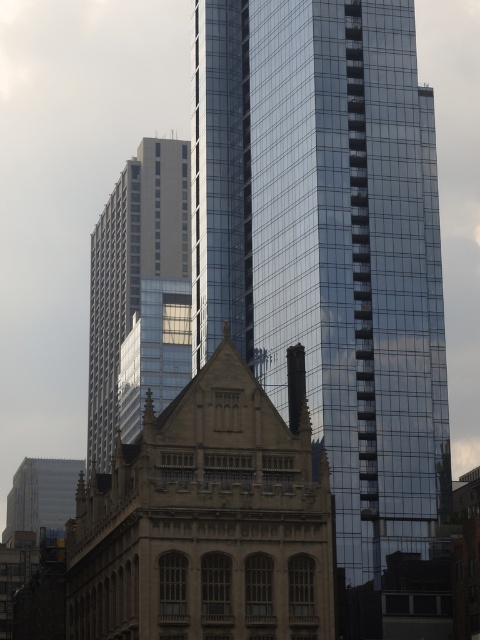
You are an architect planning to install a new lighting system. The brown stone bell tower at center and the silver metallic building at center are both candidates. Which structure requires more lights if the lighting intensity is proportional to the width of the building?

The silver metallic building at center requires more lights because it has a greater width than the brown stone bell tower at center, as stated in the description.

You are an architect planning to install a large sculpture between the brown stone bell tower at center and the silver metallic building at center. The sculpture requires a minimum of 40 meters of space between the two structures to be placed safely. Based on the scene, is the distance sufficient?

The brown stone bell tower at center and silver metallic building at center are 41.05 meters apart from each other, which exceeds the required 40 meters. Therefore, the distance is sufficient for the sculpture to be placed safely.

In the scene shown: You are an architect evaluating the spatial relationship between the brown stone bell tower at center and the silver metallic building at center in the image. Which structure is taller?

The brown stone bell tower at center has a lesser height compared to the silver metallic building at center, so the silver metallic building at center is taller.